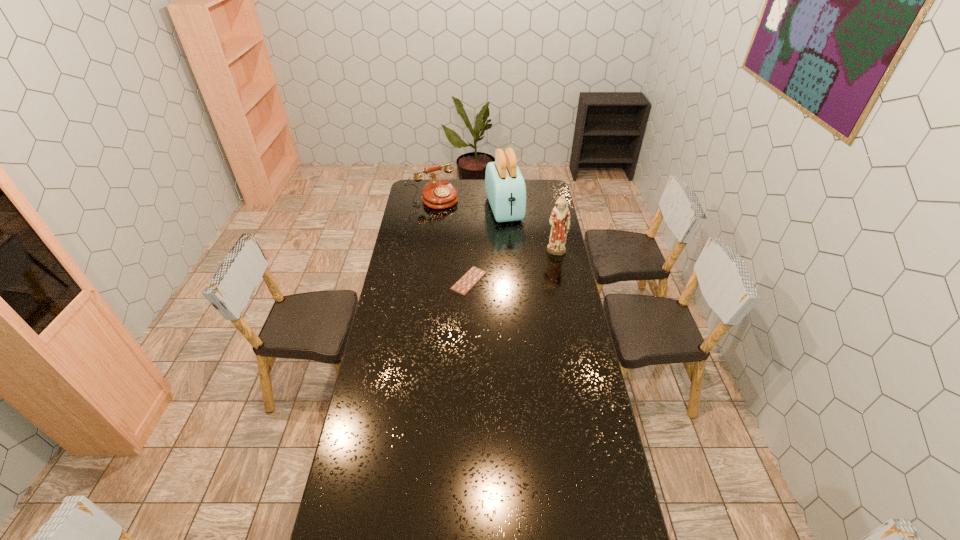
Locate an element on the screen. This screenshot has height=540, width=960. free space at the left edge of the desktop is located at coordinates (367, 426).

You are a GUI agent. You are given a task and a screenshot of the screen. Output one action in this format:
    pyautogui.click(x=<x>, y=<y>)
    Task: Click on the vacant space at the right edge
    
    Given the screenshot: What is the action you would take?
    pyautogui.click(x=567, y=258)

This screenshot has height=540, width=960. I want to click on free location at the far left corner, so click(425, 183).

Identify the location of blank space at the far right corner. (532, 196).

Locate an element on the screen. The width and height of the screenshot is (960, 540). empty space between the rightmost object and the second shortest object is located at coordinates (494, 226).

Locate an element on the screen. The width and height of the screenshot is (960, 540). free space between the rightmost object and the toaster is located at coordinates (530, 231).

Identify the location of vacant area between the chocolate bar and the toaster. This screenshot has width=960, height=540. (487, 245).

Locate an element on the screen. Image resolution: width=960 pixels, height=540 pixels. vacant area that lies between the toaster and the figurine is located at coordinates (530, 231).

Image resolution: width=960 pixels, height=540 pixels. Find the location of `empty space between the shortest object and the toaster`. empty space between the shortest object and the toaster is located at coordinates (487, 245).

I want to click on free spot between the toaster and the rightmost object, so click(530, 231).